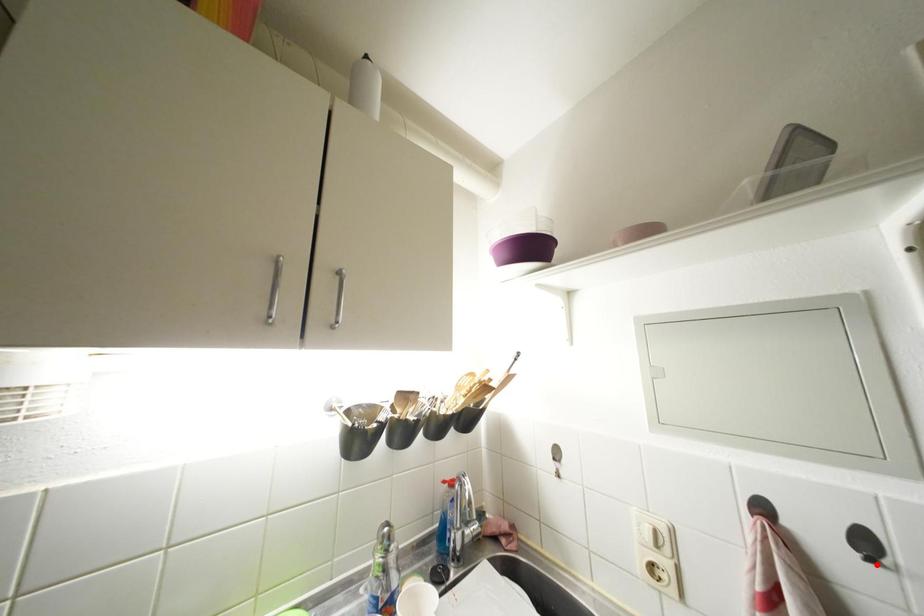
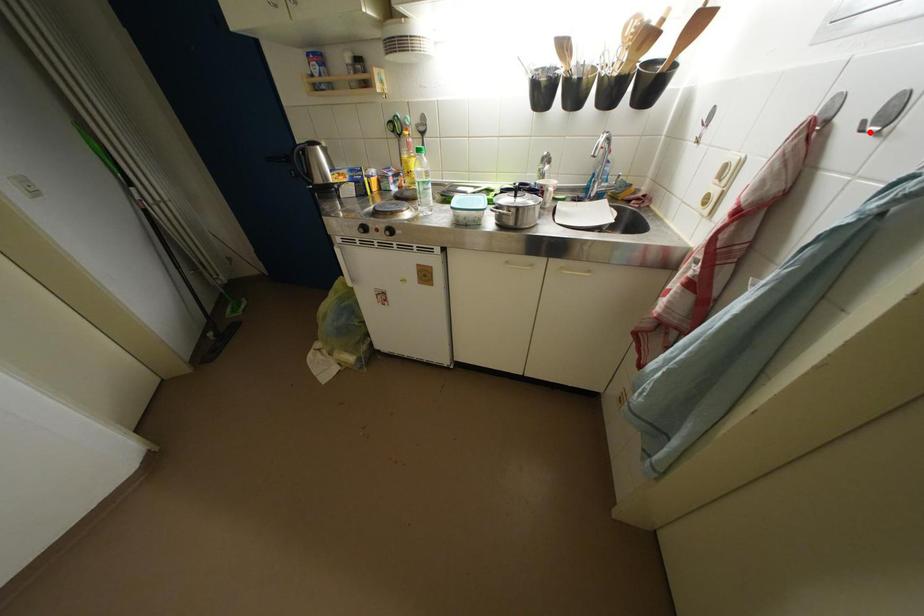
I am providing you with two images of the same scene from different viewpoints. A red point is marked on the first image and another point is marked on the second image. Is the marked point in image1 the same physical position as the marked point in image2?

Yes